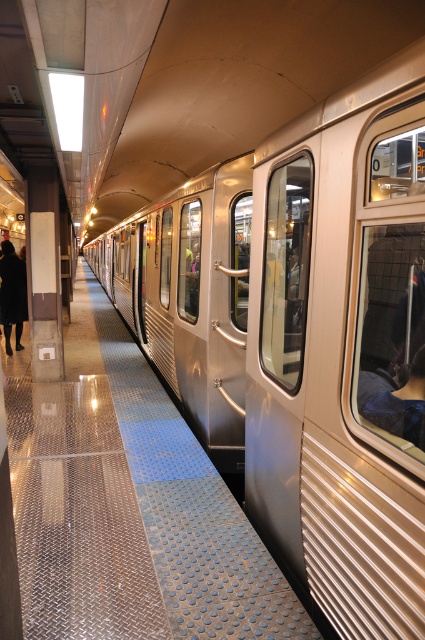
You are a passenger waiting for the next train at the subway station. You notice two items on the platform floor near the train doors. The items are the dark blue fabric at train right and the dark brown leather coat at left. Which item is wider?

The dark blue fabric at train right is narrower than the dark brown leather coat at left, so the dark brown leather coat at left is wider.

You are a commuter waiting at the subway station platform. You notice two items on the train seats. The dark blue fabric at train right and the dark brown leather coat at left. Which item takes up more space on the seat?

The dark brown leather coat at left takes up more space on the seat than the dark blue fabric at train right because the dark blue fabric at train right occupies less space than dark brown leather coat at left.